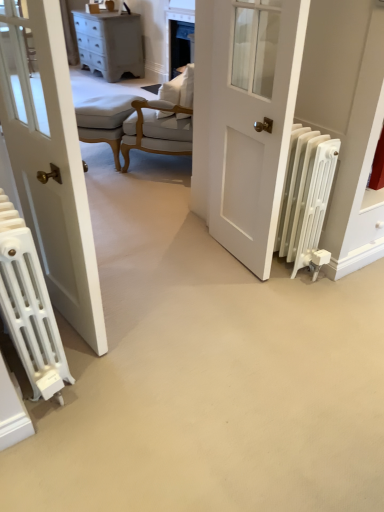
The height and width of the screenshot is (512, 384). I want to click on vacant area located to the right-hand side of white matte radiator at lower left, the second radiator viewed from the right, so click(x=127, y=362).